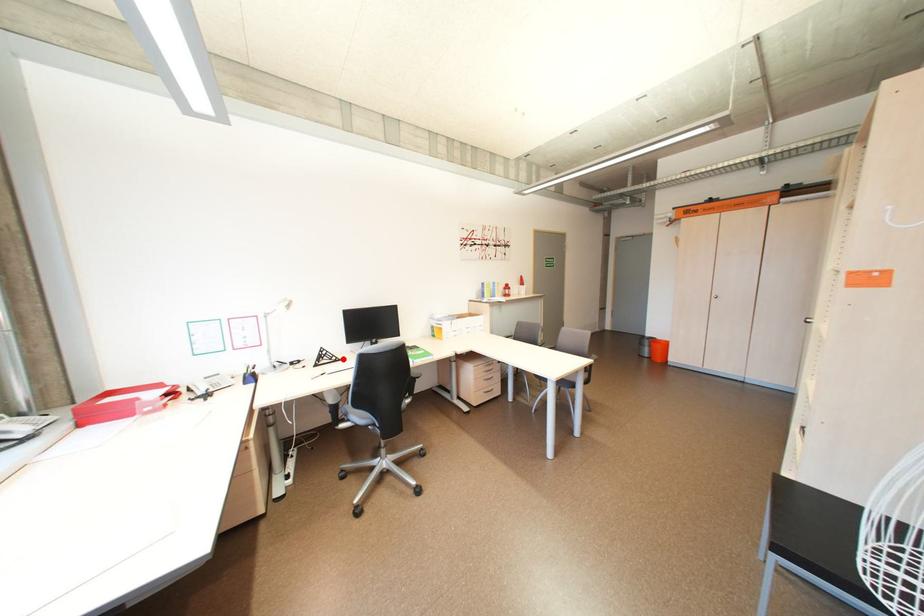
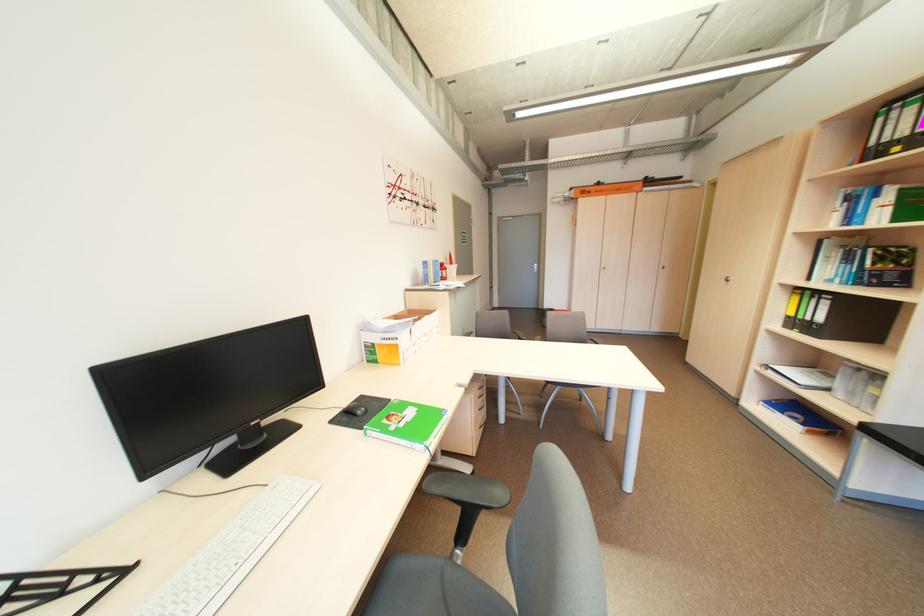
Question: I am providing you with two images of the same scene from different viewpoints. A red point is marked on the first image. At the location where the point appears in image 1, is it still visible in image 2?

Choices:
 (A) Yes
 (B) No

Answer: (A)